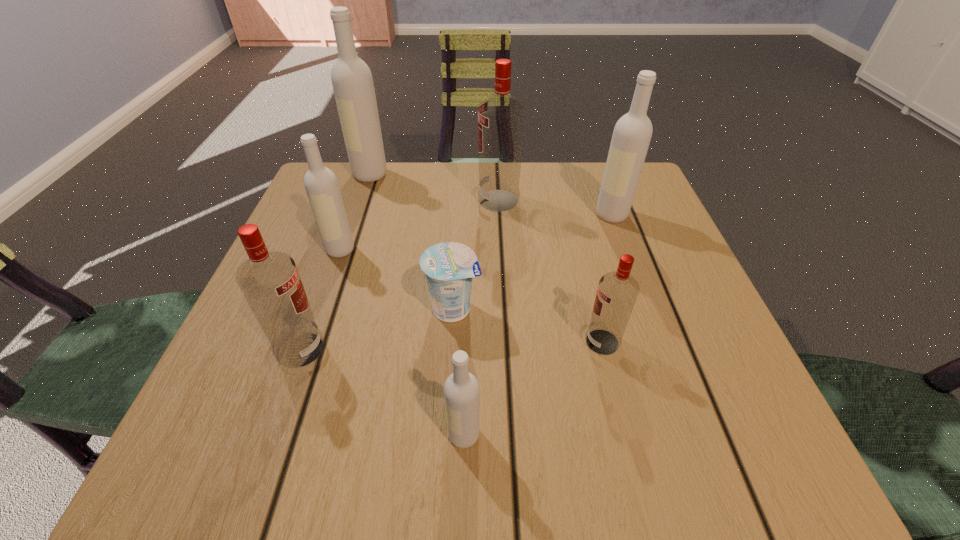
This screenshot has width=960, height=540. Identify the location of free location that satisfies the following two spatial constraints: 1. on the front label of the farthest red vodka; 2. on the front side of the yogurt. (505, 309).

The width and height of the screenshot is (960, 540). Identify the location of vacant area that satisfies the following two spatial constraints: 1. on the front side of the nearest white vodka; 2. on the right side of the farthest vodka. [282, 435].